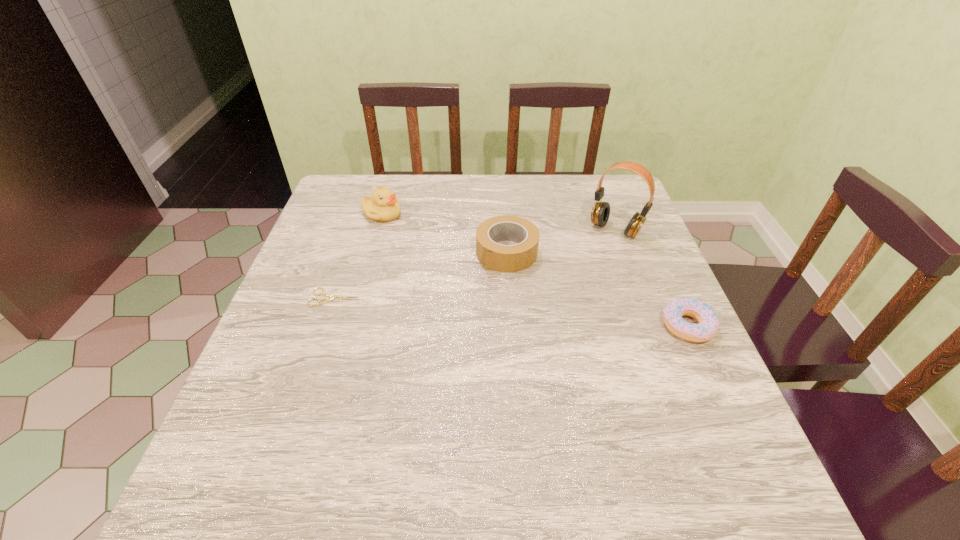
Where is `vacant space located 0.360m on the beak of the second tallest object`? The image size is (960, 540). vacant space located 0.360m on the beak of the second tallest object is located at coordinates (467, 298).

The height and width of the screenshot is (540, 960). I want to click on free space located on the beak of the second tallest object, so click(404, 236).

In order to click on vacant area located on the beak of the second tallest object in this screenshot , I will do `click(473, 306)`.

In order to click on free spot located on the ear cups of the headset in this screenshot , I will do `click(595, 253)`.

Locate an element on the screen. Image resolution: width=960 pixels, height=540 pixels. vacant space situated on the ear cups of the headset is located at coordinates (577, 277).

The image size is (960, 540). Find the location of `vacant space located on the ear cups of the headset`. vacant space located on the ear cups of the headset is located at coordinates (586, 266).

You are a GUI agent. You are given a task and a screenshot of the screen. Output one action in this format:
    pyautogui.click(x=<x>, y=<y>)
    Task: Click on the vacant point located 0.180m at the edge of the third object from right to left
    The image size is (960, 540).
    Given the screenshot: What is the action you would take?
    pyautogui.click(x=447, y=315)

You are a GUI agent. You are given a task and a screenshot of the screen. Output one action in this format:
    pyautogui.click(x=<x>, y=<y>)
    Task: Click on the free space located at the edge of the third object from right to left
    The width and height of the screenshot is (960, 540).
    Given the screenshot: What is the action you would take?
    pyautogui.click(x=433, y=329)

Locate an element on the screen. free location located 0.220m at the edge of the third object from right to left is located at coordinates (436, 326).

Where is `duckling present at the far edge`? This screenshot has height=540, width=960. duckling present at the far edge is located at coordinates (383, 206).